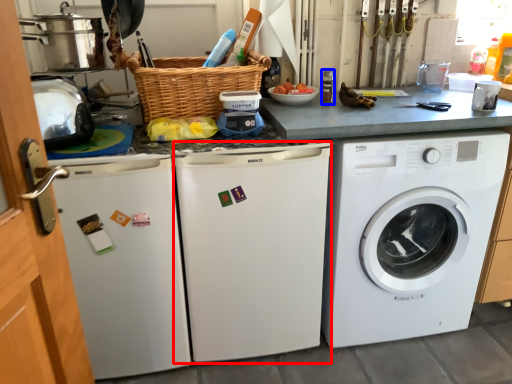
Question: Among these objects, which one is farthest to the camera, dish washer (highlighted by a red box) or appliance (highlighted by a blue box)?

Choices:
 (A) dish washer
 (B) appliance

Answer: (B)